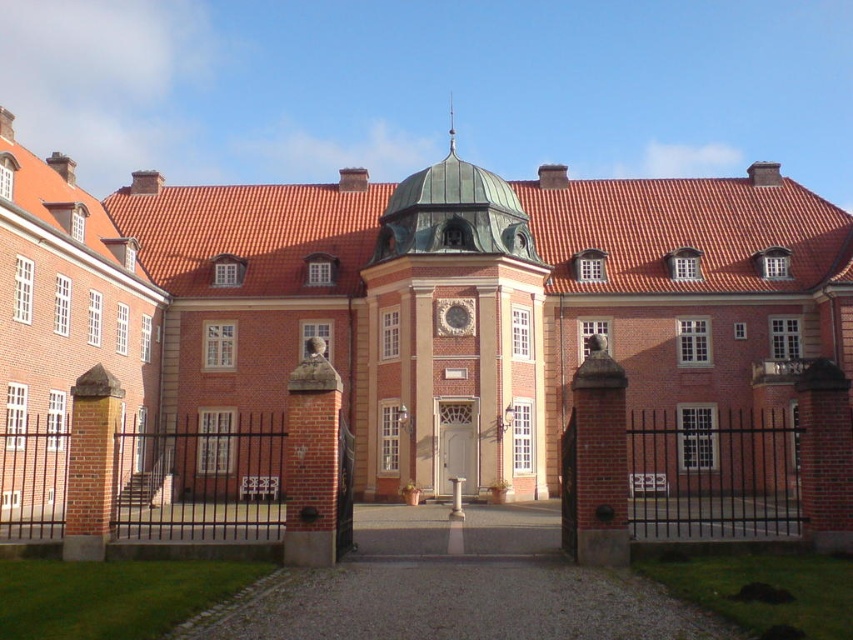
Question: Does red brick building at center have a lesser width compared to white wooden door at center?

Choices:
 (A) yes
 (B) no

Answer: (B)

Question: Can you confirm if red brick building at center is smaller than white wooden door at center?

Choices:
 (A) no
 (B) yes

Answer: (A)

Question: Which point is closer to the camera?

Choices:
 (A) red brick building at center
 (B) white wooden door at center

Answer: (A)

Question: Does red brick building at center have a lesser width compared to white wooden door at center?

Choices:
 (A) yes
 (B) no

Answer: (B)

Question: Which of the following is the farthest from the observer?

Choices:
 (A) red brick building at center
 (B) white wooden door at center

Answer: (B)

Question: Which point is farther to the camera?

Choices:
 (A) red brick building at center
 (B) white wooden door at center

Answer: (B)